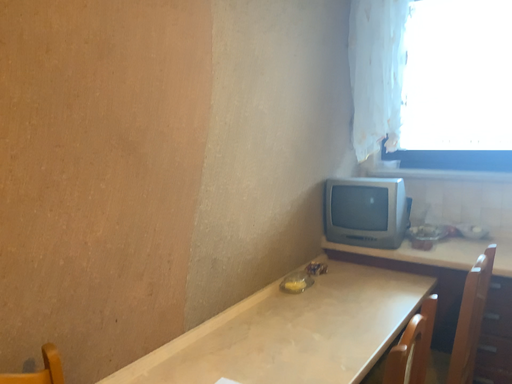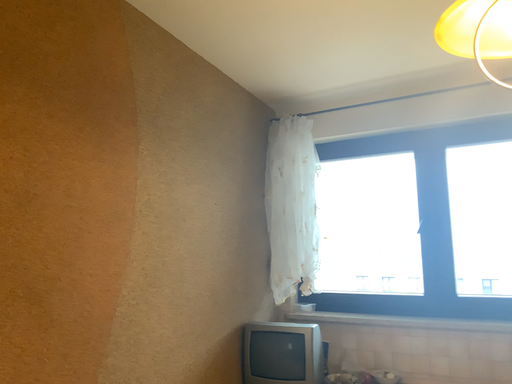
Question: How did the camera likely rotate when shooting the video?

Choices:
 (A) rotated upward
 (B) rotated downward

Answer: (A)